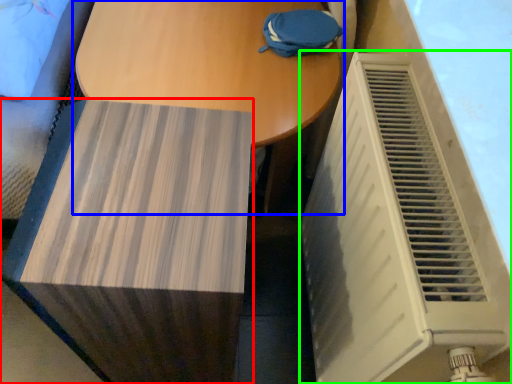
Question: Considering the real-world distances, which object is farthest from furniture (highlighted by a red box)? table (highlighted by a blue box) or air conditioning (highlighted by a green box)?

Choices:
 (A) table
 (B) air conditioning

Answer: (A)